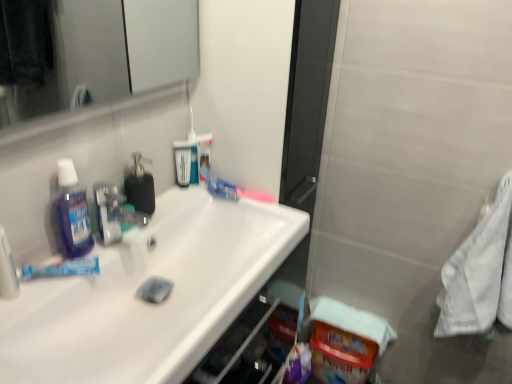
Question: Does white textured towel at right have a lesser height compared to translucent plastic toothbrush at upper center, which is counted as the 2th toothbrush, starting from the bottom?

Choices:
 (A) no
 (B) yes

Answer: (A)

Question: Can you confirm if white textured towel at right is taller than translucent plastic toothbrush at upper center, which is counted as the 2th toothbrush, starting from the bottom?

Choices:
 (A) no
 (B) yes

Answer: (B)

Question: Can you confirm if white textured towel at right is positioned to the right of translucent plastic toothbrush at upper center, placed as the 1th toothbrush when sorted from top to bottom?

Choices:
 (A) no
 (B) yes

Answer: (B)

Question: Does white textured towel at right have a smaller size compared to translucent plastic toothbrush at upper center, placed as the second toothbrush when sorted from right to left?

Choices:
 (A) yes
 (B) no

Answer: (B)

Question: Can you confirm if white textured towel at right is positioned to the left of translucent plastic toothbrush at upper center, placed as the second toothbrush when sorted from right to left?

Choices:
 (A) no
 (B) yes

Answer: (A)

Question: Is white textured towel at right wider than translucent plastic toothbrush at upper center, placed as the 1th toothbrush when sorted from top to bottom?

Choices:
 (A) yes
 (B) no

Answer: (A)

Question: Is blue matte toothpaste at left behind blue glossy mouthwash at upper center, which is counted as the 2th mouthwash, starting from the back?

Choices:
 (A) no
 (B) yes

Answer: (A)

Question: From a real-world perspective, is blue matte toothpaste at left on blue glossy mouthwash at upper center, which appears as the second mouthwash when viewed from the left?

Choices:
 (A) no
 (B) yes

Answer: (A)

Question: Can you confirm if blue matte toothpaste at left is taller than blue glossy mouthwash at upper center, which appears as the second mouthwash when viewed from the left?

Choices:
 (A) yes
 (B) no

Answer: (B)

Question: Can you confirm if blue matte toothpaste at left is positioned to the right of blue glossy mouthwash at upper center, the 2th mouthwash viewed from the right?

Choices:
 (A) yes
 (B) no

Answer: (B)

Question: Is blue matte toothpaste at left wider than blue glossy mouthwash at upper center, which is counted as the 2th mouthwash, starting from the back?

Choices:
 (A) yes
 (B) no

Answer: (A)

Question: Considering the relative sizes of blue matte toothpaste at left and blue glossy mouthwash at upper center, the 2th mouthwash positioned from the front, in the image provided, is blue matte toothpaste at left shorter than blue glossy mouthwash at upper center, the 2th mouthwash positioned from the front,?

Choices:
 (A) yes
 (B) no

Answer: (A)

Question: Can you confirm if translucent purple mouthwash at left, marked as the 3th mouthwash in a right-to-left arrangement, is thinner than white textured towel at right?

Choices:
 (A) no
 (B) yes

Answer: (B)